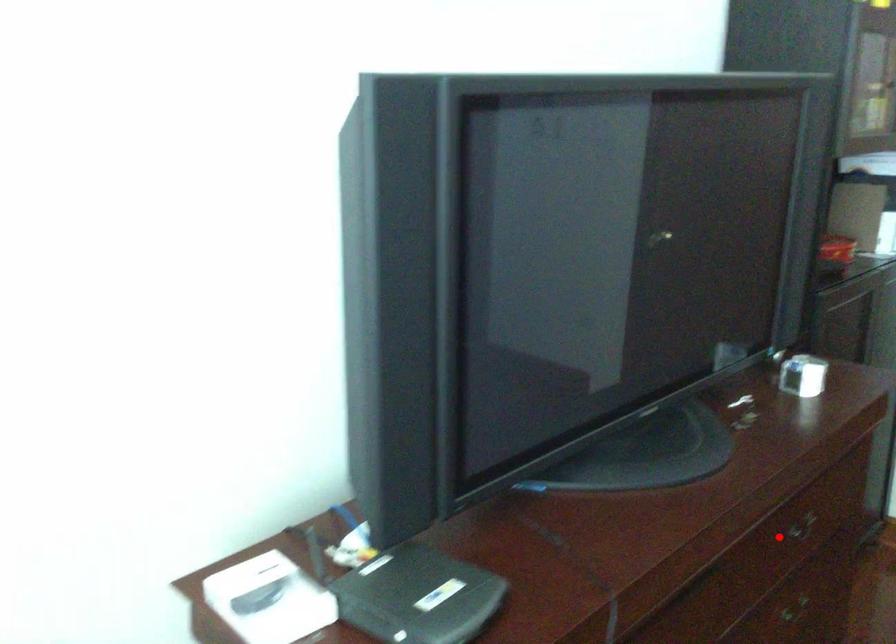
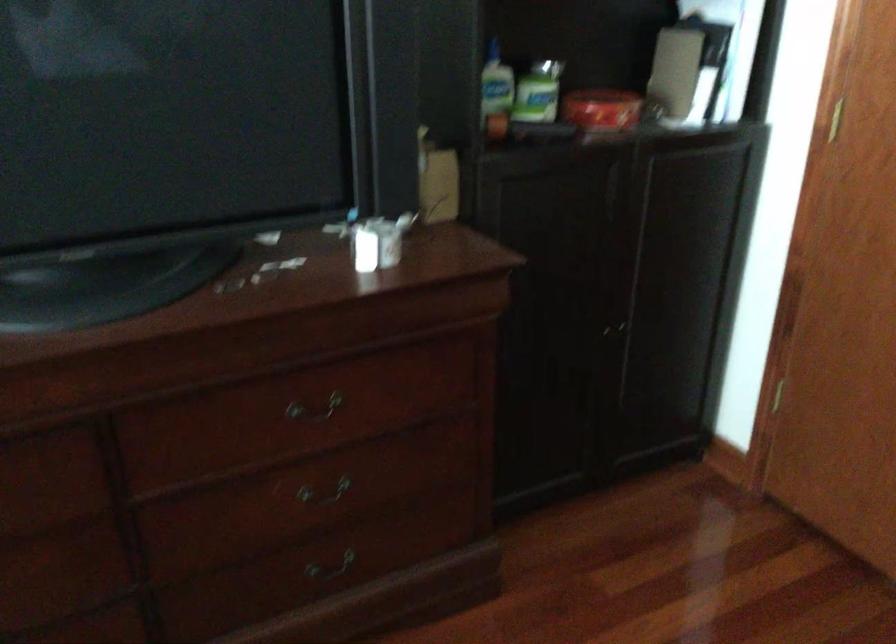
Find the pixel in the second image that matches the highlighted location in the first image.

(314, 409)